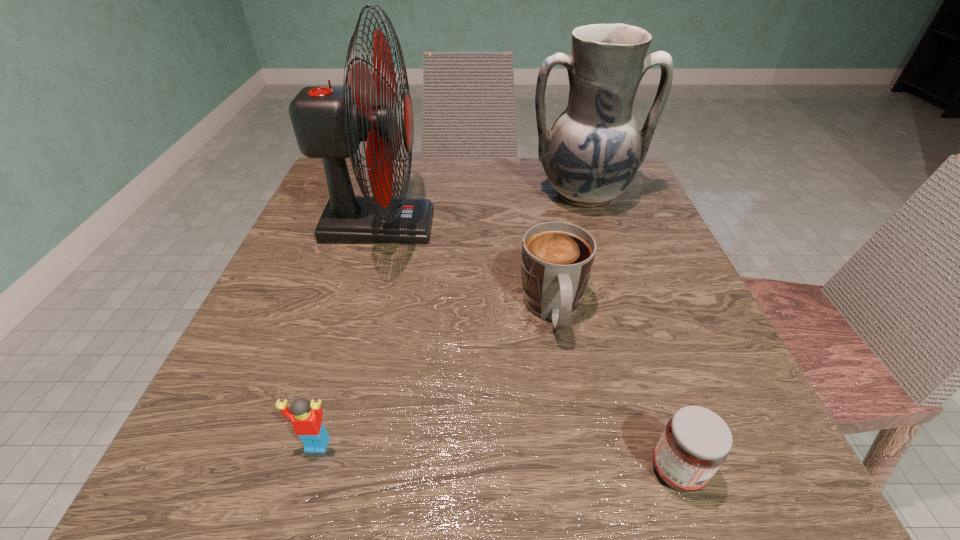
This screenshot has width=960, height=540. Find the location of `the tallest object`. the tallest object is located at coordinates (329, 122).

Where is `pitcher`? The height and width of the screenshot is (540, 960). pitcher is located at coordinates (591, 155).

Where is `mug`? This screenshot has width=960, height=540. mug is located at coordinates (557, 257).

This screenshot has height=540, width=960. Identify the location of Lego. (306, 418).

Where is `jam`? This screenshot has width=960, height=540. jam is located at coordinates (696, 441).

Find the location of a particular element. This screenshot has height=540, width=960. free space located on the front-facing side of the tallest object is located at coordinates (574, 226).

The image size is (960, 540). Find the location of `free location located 0.360m on the front-facing side of the pitcher`. free location located 0.360m on the front-facing side of the pitcher is located at coordinates (637, 359).

This screenshot has width=960, height=540. Find the location of `vacant space located on the side of the mug with the handle`. vacant space located on the side of the mug with the handle is located at coordinates (575, 442).

The width and height of the screenshot is (960, 540). I want to click on vacant point located 0.090m on the back of the jam, so click(649, 383).

This screenshot has height=540, width=960. Find the location of `fan that is positioned at the far edge`. fan that is positioned at the far edge is located at coordinates (329, 122).